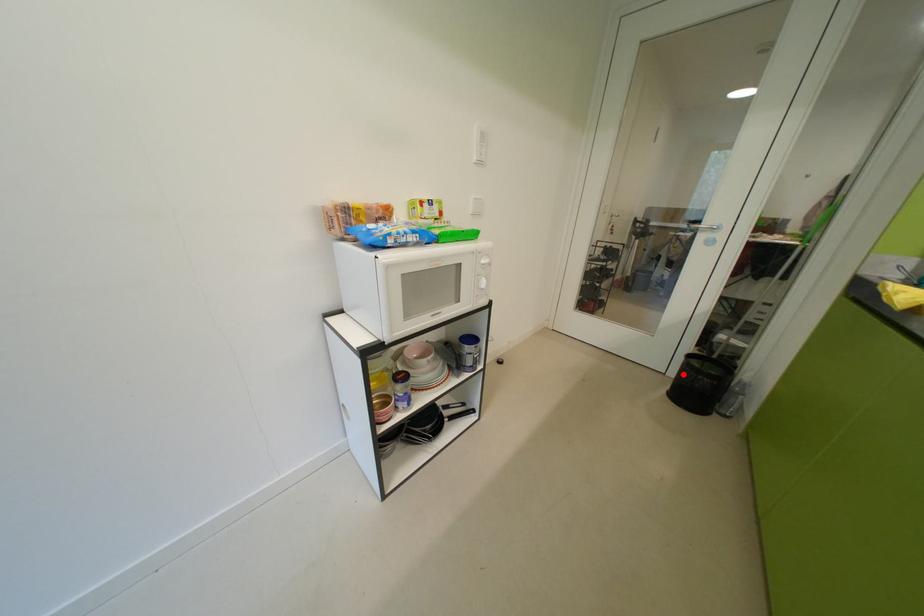
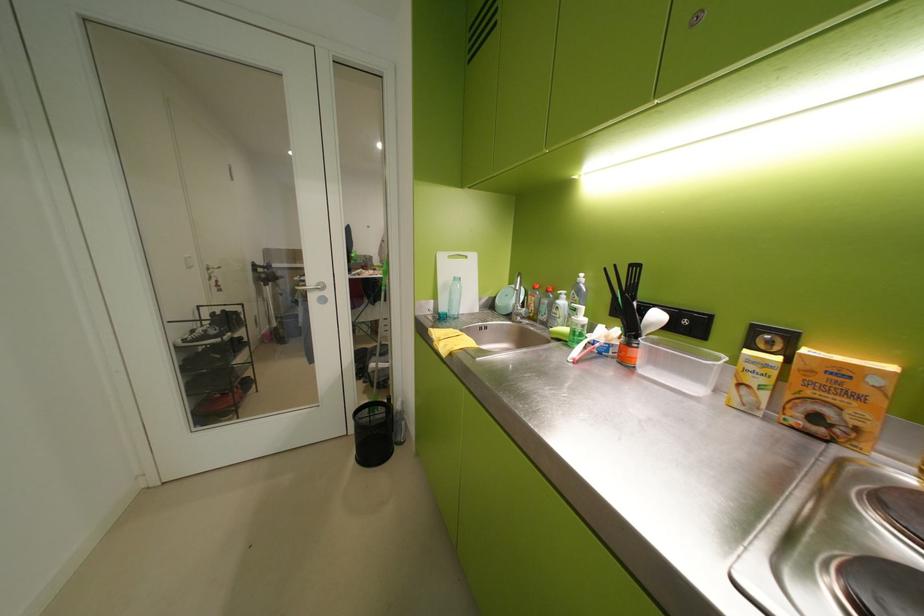
Find the pixel in the second image that matches the highlighted location in the first image.

(363, 432)